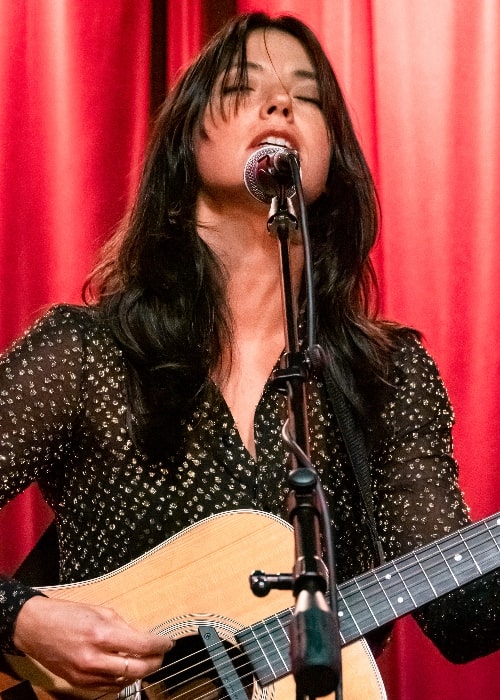
Find the location of a particular element. stand is located at coordinates (300, 414).